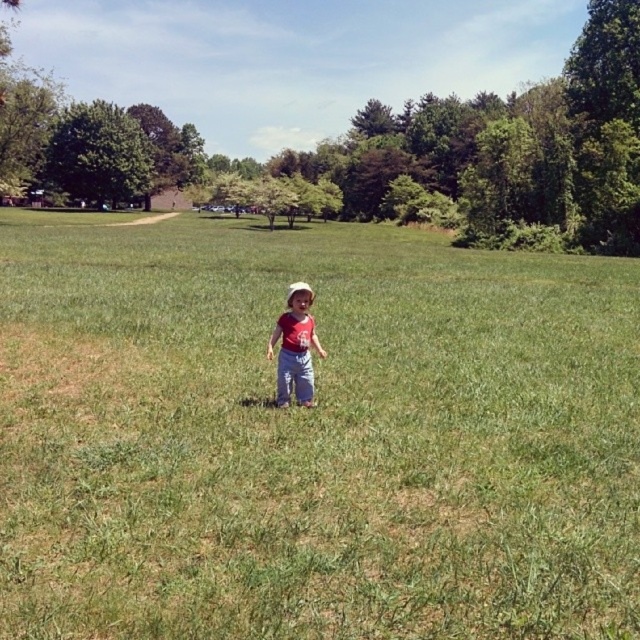
You are a drone operator trying to capture a photo of the green grass at center and the matte red shirt at center. Your drone has a camera with a maximum focus range of 15 meters. Can your drone capture both objects in focus at the same time?

The green grass at center and matte red shirt at center are 15.10 meters apart from each other. Since the maximum focus range is 15 meters, the distance between them exceeds this limit. Therefore, the drone cannot capture both objects in focus simultaneously.

You are a parent trying to locate your child in the grassy field. You see the green grass at center and the matte red shirt at center. Which object is taller?

The green grass at center is taller than the matte red shirt at center.